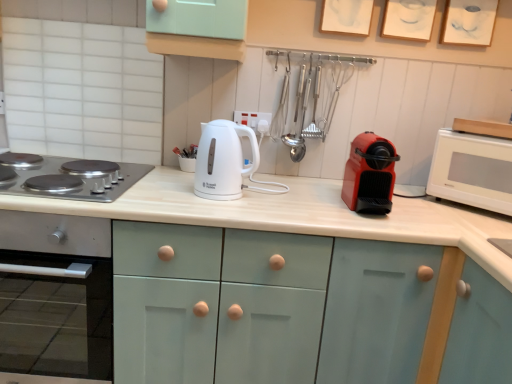
Find the location of a particular element. free location to the right of white glossy electric kettle at center, which appears as the 2th kitchen appliance when viewed from the right is located at coordinates (280, 202).